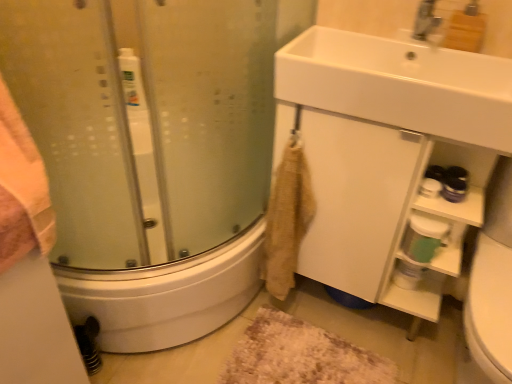
Where is `vacant space situated above brown shaggy bath mat at lower center (from a real-world perspective)`? vacant space situated above brown shaggy bath mat at lower center (from a real-world perspective) is located at coordinates (311, 354).